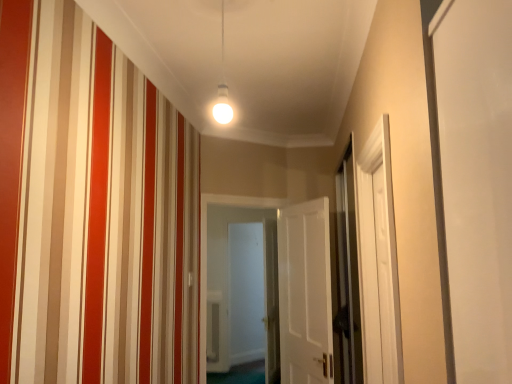
Question: Can you confirm if white glossy door at center, which is the 1th screen door from back to front, is shorter than white matte door at center, which is the second door in left-to-right order?

Choices:
 (A) yes
 (B) no

Answer: (B)

Question: From the image's perspective, does white glossy door at center, the 2th screen door viewed from the right, appear lower than white matte door at center, marked as the 1th door in a right-to-left arrangement?

Choices:
 (A) yes
 (B) no

Answer: (A)

Question: Does white glossy door at center, which is the 1th screen door from back to front, appear on the right side of white matte door at center, marked as the 1th door in a right-to-left arrangement?

Choices:
 (A) no
 (B) yes

Answer: (A)

Question: Is white glossy door at center, the 2th screen door viewed from the right, oriented towards white matte door at center, marked as the 1th door in a right-to-left arrangement?

Choices:
 (A) yes
 (B) no

Answer: (B)

Question: Does white glossy door at center, which is the 1th screen door from back to front, have a greater height compared to white matte door at center, which is the second door in left-to-right order?

Choices:
 (A) yes
 (B) no

Answer: (A)

Question: Does point (337, 311) appear closer or farther from the camera than point (242, 233)?

Choices:
 (A) closer
 (B) farther

Answer: (A)

Question: In terms of height, does clear glass screen door at right, the second screen door viewed from the back, look taller or shorter compared to white glossy door at center, the 2th screen door viewed from the right?

Choices:
 (A) short
 (B) tall

Answer: (A)

Question: From a real-world perspective, is clear glass screen door at right, the second screen door from the left, positioned above or below white glossy door at center, acting as the first screen door starting from the left?

Choices:
 (A) below
 (B) above

Answer: (B)

Question: Based on their positions, is clear glass screen door at right, which is the first screen door from right to left, located to the left or right of white glossy door at center, the 2th screen door viewed from the right?

Choices:
 (A) left
 (B) right

Answer: (B)

Question: Is white glossy door at center, acting as the first screen door starting from the left, wider or thinner than white wooden door at center, the 2th door in the right-to-left sequence?

Choices:
 (A) wide
 (B) thin

Answer: (B)

Question: Is white glossy door at center, the 2th screen door viewed from the right, in front of or behind white wooden door at center, the 2th door in the right-to-left sequence, in the image?

Choices:
 (A) front
 (B) behind

Answer: (B)

Question: From a real-world perspective, is white glossy door at center, which is the 1th screen door from back to front, above or below white wooden door at center, which ranks as the first door in left-to-right order?

Choices:
 (A) above
 (B) below

Answer: (B)

Question: Considering the positions of white glossy door at center, which is the 1th screen door from back to front, and white wooden door at center, the 2th door in the right-to-left sequence, in the image, is white glossy door at center, which is the 1th screen door from back to front, taller or shorter than white wooden door at center, the 2th door in the right-to-left sequence,?

Choices:
 (A) short
 (B) tall

Answer: (B)

Question: Looking at their shapes, would you say white matte door at center, which is the second door in left-to-right order, is wider or thinner than white wooden door at center, which ranks as the first door in left-to-right order?

Choices:
 (A) wide
 (B) thin

Answer: (B)

Question: Is white matte door at center, marked as the 1th door in a right-to-left arrangement, in front of or behind white wooden door at center, which ranks as the first door in left-to-right order, in the image?

Choices:
 (A) front
 (B) behind

Answer: (A)